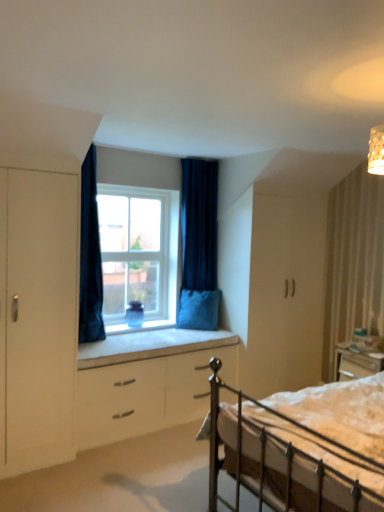
I want to click on free point to the right of white matte cabinet at left, so click(84, 463).